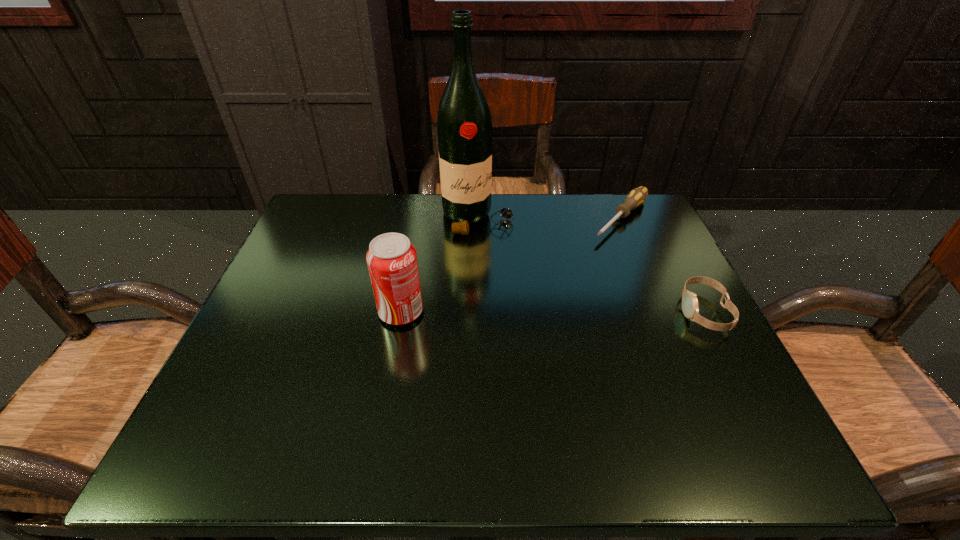
Identify the location of the leftmost object. The image size is (960, 540). (392, 262).

The width and height of the screenshot is (960, 540). In order to click on soda can in this screenshot , I will do `click(392, 262)`.

Where is `watch`? watch is located at coordinates (690, 308).

Where is `screwdriver`? The height and width of the screenshot is (540, 960). screwdriver is located at coordinates (636, 197).

Where is `the second object from left to right`? This screenshot has width=960, height=540. the second object from left to right is located at coordinates point(464,127).

Locate an element on the screen. The width and height of the screenshot is (960, 540). wine bottle is located at coordinates (464, 127).

Where is `free spot located on the logo side of the soda can`? This screenshot has height=540, width=960. free spot located on the logo side of the soda can is located at coordinates (309, 312).

I want to click on free space located on the logo side of the soda can, so click(x=264, y=312).

Where is `vacant space located 0.180m on the logo side of the soda can`? Image resolution: width=960 pixels, height=540 pixels. vacant space located 0.180m on the logo side of the soda can is located at coordinates (289, 312).

You are a GUI agent. You are given a task and a screenshot of the screen. Output one action in this format:
    pyautogui.click(x=<x>, y=<y>)
    Task: Click on the free space located 0.170m on the face of the second shortest object
    
    Given the screenshot: What is the action you would take?
    pyautogui.click(x=597, y=312)